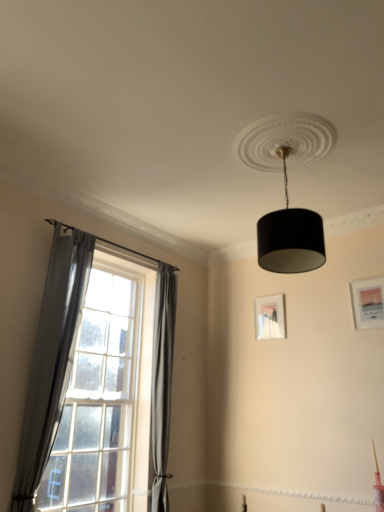
Question: Is matte white picture frame at center, positioned as the second picture frame in right-to-left order, located outside gray fabric curtain at left, arranged as the 1th curtain when viewed from the left?

Choices:
 (A) no
 (B) yes

Answer: (B)

Question: Can you confirm if matte white picture frame at center, acting as the 1th picture frame starting from the back, is taller than gray fabric curtain at left, arranged as the 1th curtain when viewed from the left?

Choices:
 (A) yes
 (B) no

Answer: (B)

Question: Could you tell me if matte white picture frame at center, which ranks as the second picture frame in front-to-back order, is turned towards gray fabric curtain at left, the 1th curtain when ordered from front to back?

Choices:
 (A) yes
 (B) no

Answer: (A)

Question: From a real-world perspective, is matte white picture frame at center, acting as the 1th picture frame starting from the back, on gray fabric curtain at left, the 1th curtain when ordered from front to back?

Choices:
 (A) yes
 (B) no

Answer: (A)

Question: Can you confirm if matte white picture frame at center, which ranks as the second picture frame in front-to-back order, is bigger than gray fabric curtain at left, which is the second curtain from back to front?

Choices:
 (A) yes
 (B) no

Answer: (B)

Question: From the image's perspective, is gray fabric curtain at left, arranged as the 1th curtain when viewed from the left, above or below matte white picture frame at upper right, arranged as the second picture frame when viewed from the left?

Choices:
 (A) above
 (B) below

Answer: (B)

Question: In terms of size, does gray fabric curtain at left, which is the 2th curtain from right to left, appear bigger or smaller than matte white picture frame at upper right, arranged as the second picture frame when viewed from the left?

Choices:
 (A) big
 (B) small

Answer: (A)

Question: Would you say gray fabric curtain at left, the 1th curtain when ordered from front to back, is to the left or to the right of matte white picture frame at upper right, which is the first picture frame from right to left, in the picture?

Choices:
 (A) left
 (B) right

Answer: (A)

Question: Looking at their shapes, would you say gray fabric curtain at left, the 1th curtain when ordered from front to back, is wider or thinner than matte white picture frame at upper right, acting as the 1th picture frame starting from the front?

Choices:
 (A) wide
 (B) thin

Answer: (A)

Question: Visually, is matte white picture frame at upper right, which is the first picture frame from right to left, positioned to the left or to the right of black textured lampshade at upper center?

Choices:
 (A) right
 (B) left

Answer: (A)

Question: Does point (367, 321) appear closer or farther from the camera than point (289, 256)?

Choices:
 (A) farther
 (B) closer

Answer: (A)

Question: Looking at the image, does matte white picture frame at upper right, arranged as the second picture frame when viewed from the left, seem bigger or smaller compared to black textured lampshade at upper center?

Choices:
 (A) small
 (B) big

Answer: (A)

Question: Is matte white picture frame at upper right, arranged as the second picture frame when viewed from the left, inside the boundaries of black textured lampshade at upper center, or outside?

Choices:
 (A) inside
 (B) outside

Answer: (B)

Question: Considering their positions, is gray fabric curtain at left, the 2th curtain positioned from the front, located in front of or behind clear glass window at left?

Choices:
 (A) front
 (B) behind

Answer: (B)

Question: Considering the positions of gray fabric curtain at left, placed as the 1th curtain when sorted from right to left, and clear glass window at left in the image, is gray fabric curtain at left, placed as the 1th curtain when sorted from right to left, bigger or smaller than clear glass window at left?

Choices:
 (A) small
 (B) big

Answer: (A)